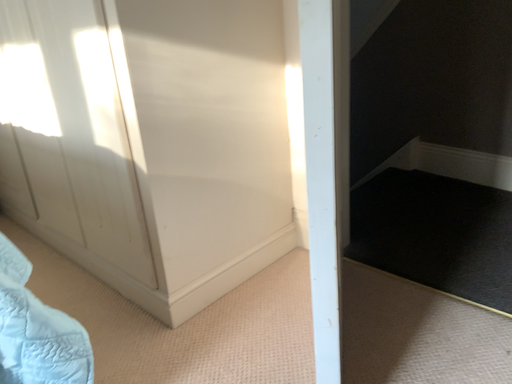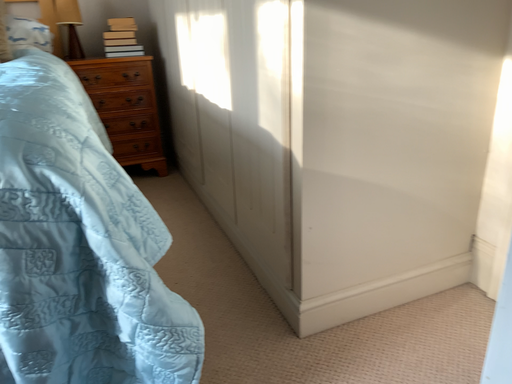
Question: How did the camera likely rotate when shooting the video?

Choices:
 (A) rotated right
 (B) rotated left

Answer: (B)